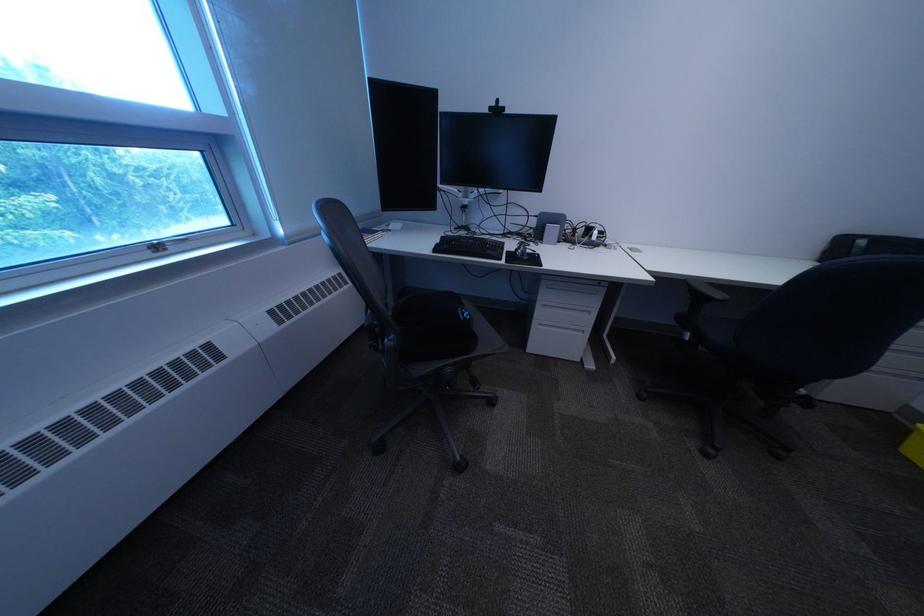
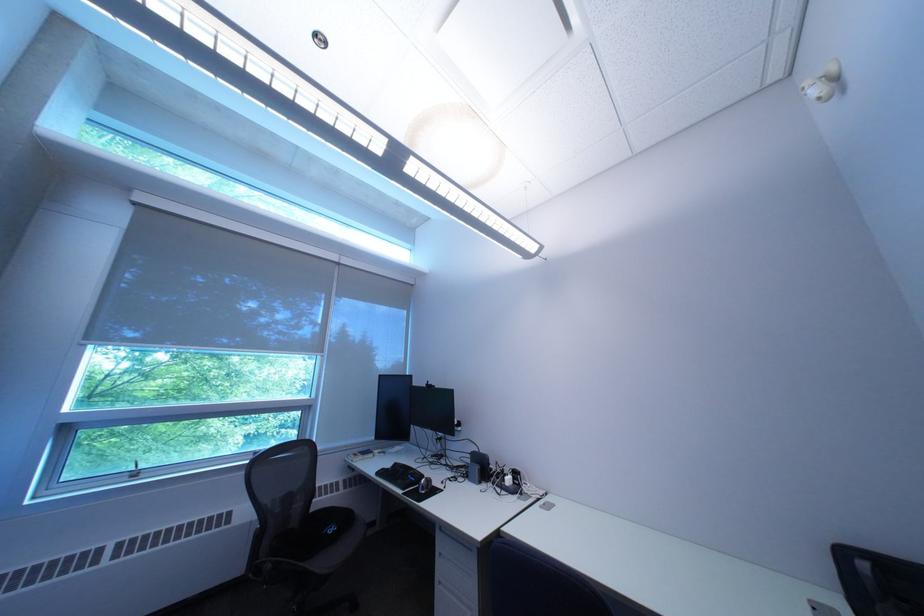
Where in the second image is the point corresponding to (465,371) from the first image?

(285, 568)